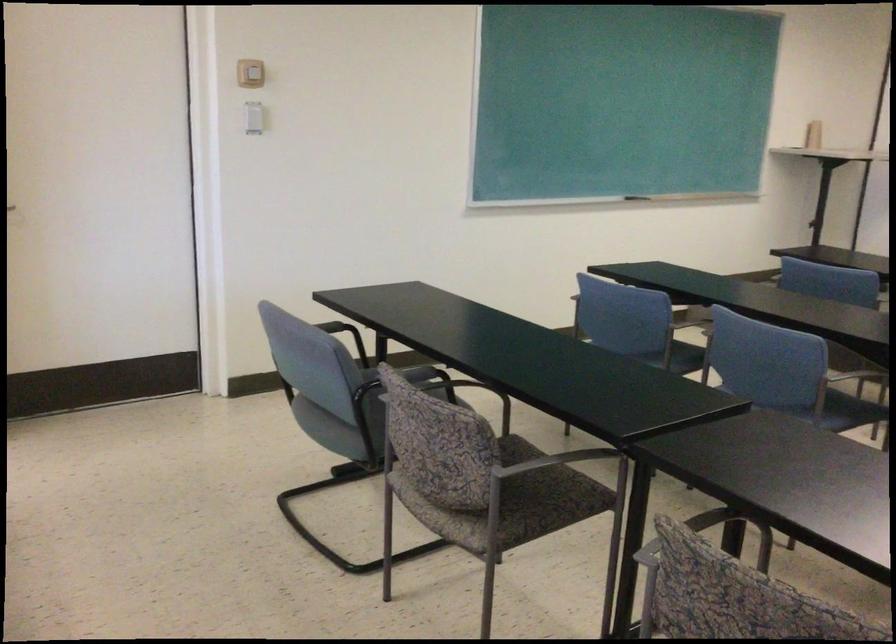
Locate an element on the screen. The height and width of the screenshot is (644, 896). white light switch is located at coordinates (250, 73).